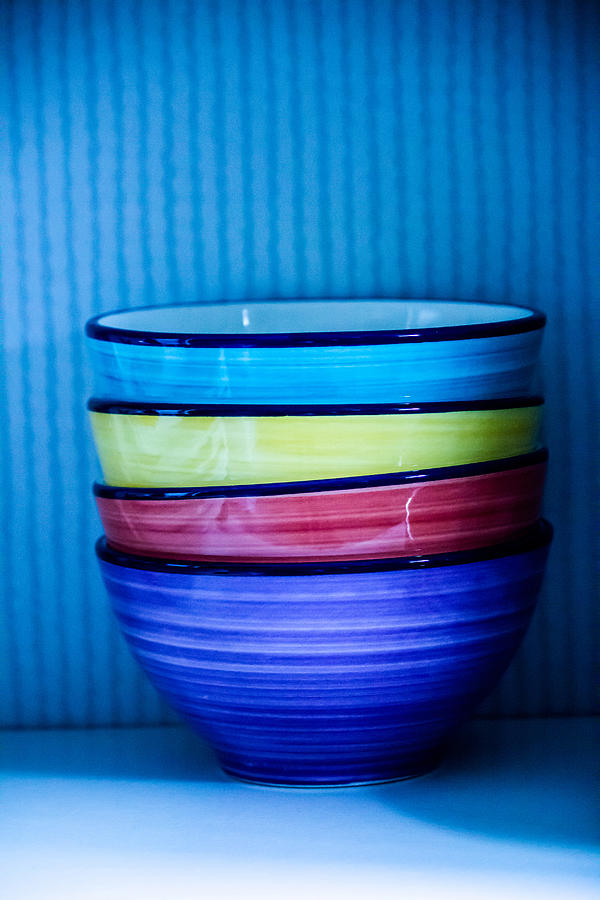
This screenshot has width=600, height=900. Find the location of `rim of bowl`. rim of bowl is located at coordinates (312, 297), (310, 339), (312, 410), (316, 483), (307, 570).